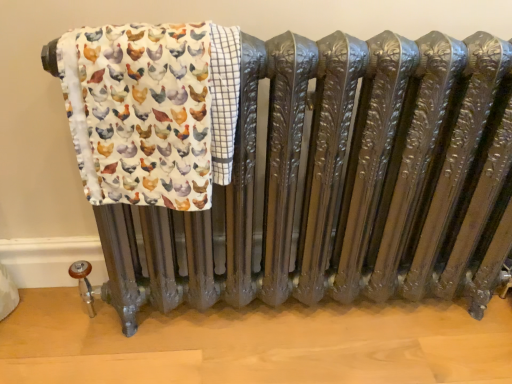
This screenshot has height=384, width=512. What do you see at coordinates (152, 110) in the screenshot?
I see `white fabric with chicken print at center` at bounding box center [152, 110].

The width and height of the screenshot is (512, 384). Identify the location of white fabric with chicken print at center. tap(152, 110).

Where is `white fabric with chicken print at center`? This screenshot has width=512, height=384. white fabric with chicken print at center is located at coordinates (152, 110).